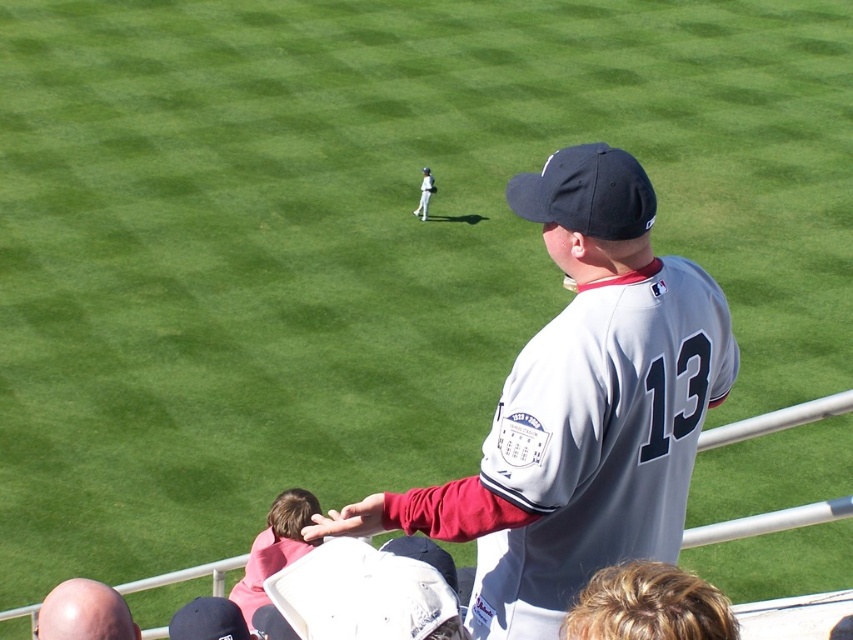
What is the 2D coordinate of the matte dark blue baseball cap at center in the image?

The matte dark blue baseball cap at center is located at the 2D coordinate point of (x=585, y=193).

You are a photographer standing at the camera position. You want to take a photo of the man in the gray baseball jersey with the number 13 on the back. The man is currently facing away from the camera towards the field. To get a clear shot of his face, you need to move to a point that is 4.29 meters away from the current camera position. Is the point at coordinates point (646, 550) suitable for this purpose?

The point at point (646, 550) is exactly 4.29 meters away from the camera. However, since the man is facing away from the camera towards the field, moving to this point would still position him facing away from the new camera location, making it difficult to capture his face clearly. Consider repositioning to a different angle where he faces the camera.

Based on the photo, you are a photographer standing at the edge of the baseball field. You need to take a photo that includes both the blonde hair at center and the pink fabric shirt at lower center. What is the minimum distance you should set your camera lens to capture both subjects in the same frame?

The minimum distance required to capture both the blonde hair at center and the pink fabric shirt at lower center in the same frame is 5.50 meters, as they are separated by that distance.